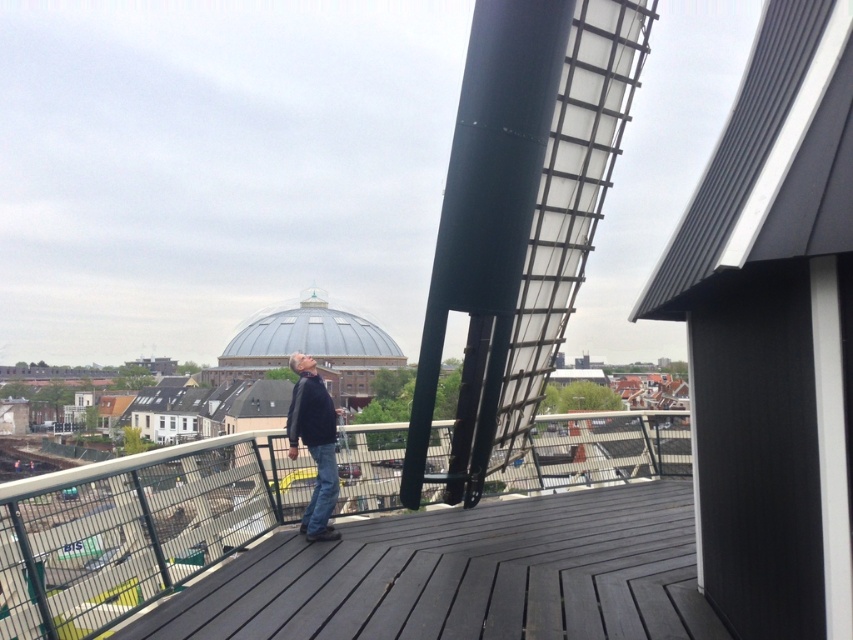
Locate an element on the screen. This screenshot has width=853, height=640. dark gray wood deck at center is located at coordinates (465, 577).

Where is `dark gray wood deck at center`? dark gray wood deck at center is located at coordinates (465, 577).